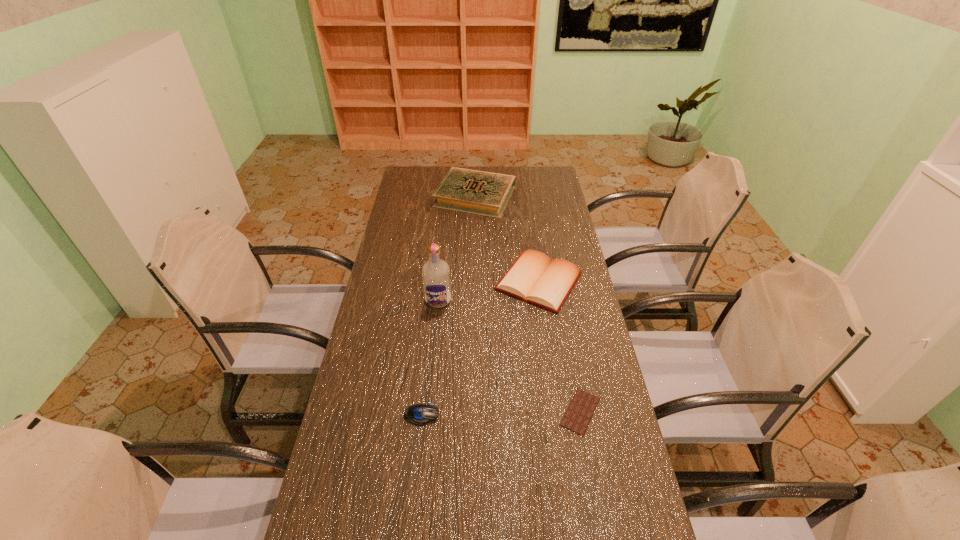
Identify the location of the tallest object. click(x=436, y=272).

The image size is (960, 540). I want to click on the farthest object, so click(x=485, y=193).

Where is `hardback book`? hardback book is located at coordinates (485, 193).

Where is `Bible`? The width and height of the screenshot is (960, 540). Bible is located at coordinates [535, 278].

Identify the location of the fourth tallest object. The image size is (960, 540). (x=418, y=414).

I want to click on chocolate bar, so (581, 409).

At what (x,y) coordinates should I click in order to perform the action: click on vacant point located 0.240m on the label of the vodka. Please return your answer as a coordinate pair (x, y). This screenshot has height=540, width=960. Looking at the image, I should click on (432, 366).

Identify the location of vacant position located 0.080m on the left of the hardback book. (417, 196).

Locate an element on the screen. vacant point located on the back of the Bible is located at coordinates (532, 233).

What are the coordinates of `vacant space located 0.320m on the button side of the computer mouse` in the screenshot? It's located at (554, 415).